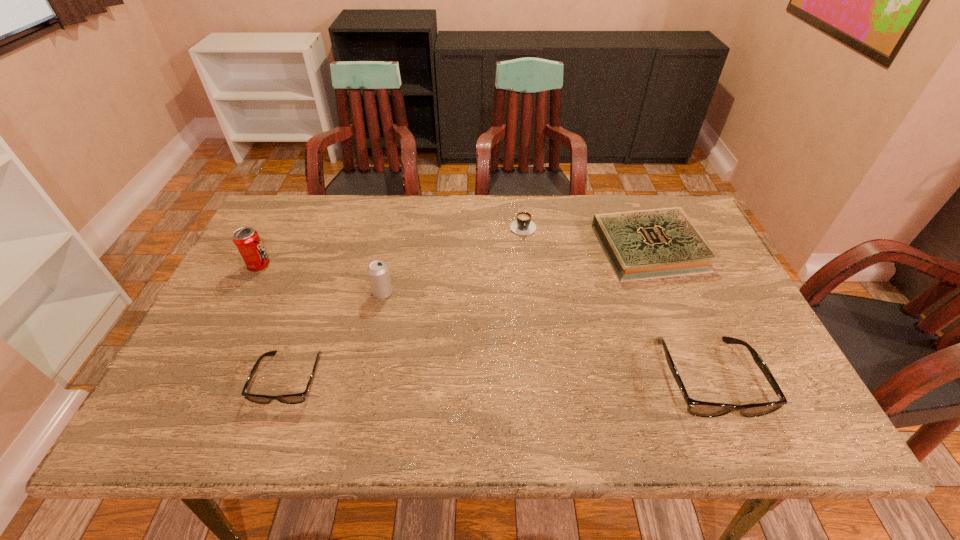
To make them evenly spaced by inserting another spectacles among them, please locate a vacant spot for this new spectacles. Please provide its 2D coordinates. Your answer should be formatted as a tuple, i.e. [(x, y)], where the tuple contains the x and y coordinates of a point satisfying the conditions above.

[(498, 379)]